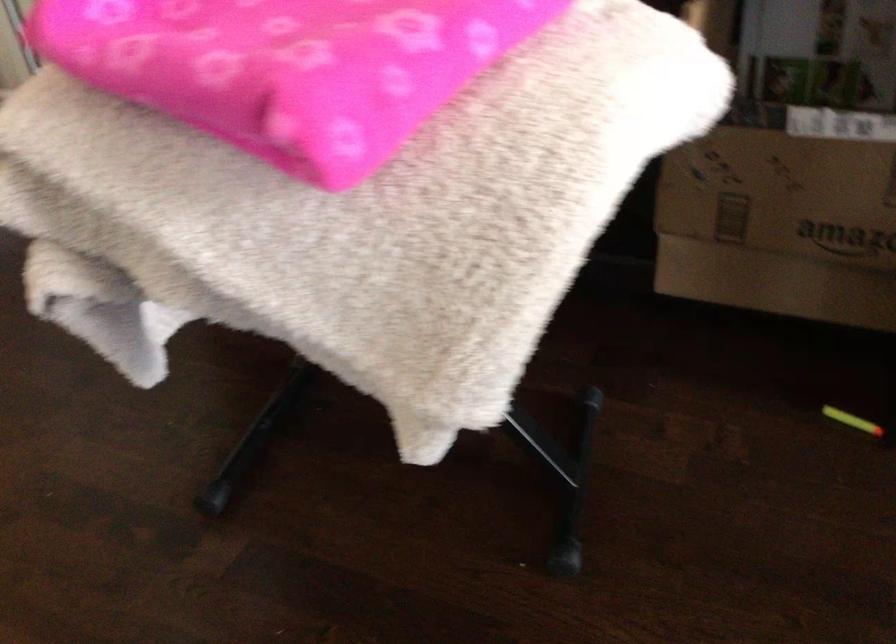
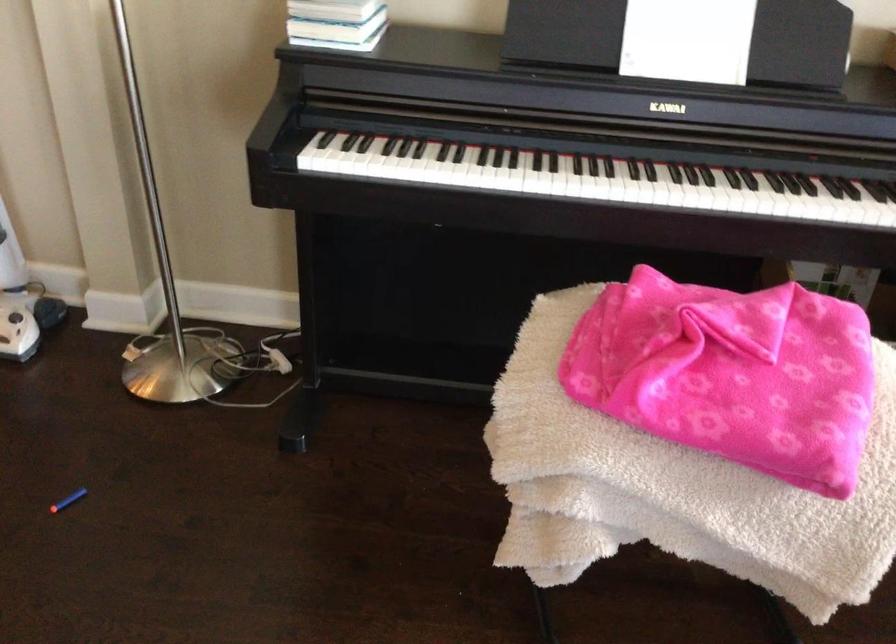
What movement of the cameraman would produce the second image?

The cameraman walked toward left, backward.